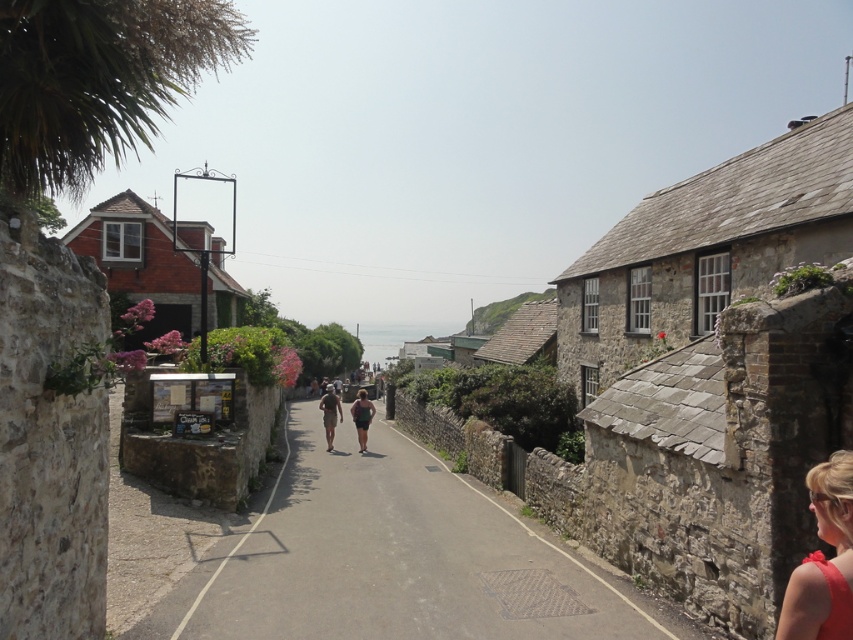
Between stone paved alley at center and matte red dress at lower right, which one has less height?

matte red dress at lower right is shorter.

Is point (383, 449) more distant than point (831, 488)?

Yes.

Locate an element on the screen. stone paved alley at center is located at coordinates (393, 557).